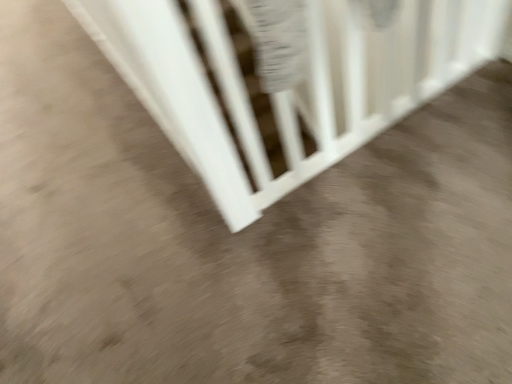
Measure the distance between point (191, 59) and camera.

Point (191, 59) is 3.97 feet from camera.

Find the location of a particular element. The image size is (512, 384). white plastic crib at upper center is located at coordinates pos(288,90).

The image size is (512, 384). What do you see at coordinates (288, 90) in the screenshot?
I see `white plastic crib at upper center` at bounding box center [288, 90].

Find the location of `white plastic crib at upper center`. white plastic crib at upper center is located at coordinates (288, 90).